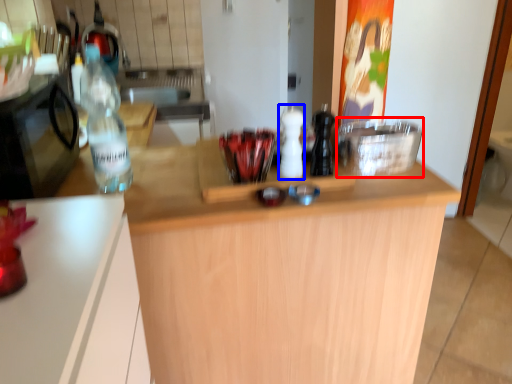
Question: Which object is further to the camera taking this photo, appliance (highlighted by a red box) or bottle (highlighted by a blue box)?

Choices:
 (A) appliance
 (B) bottle

Answer: (A)